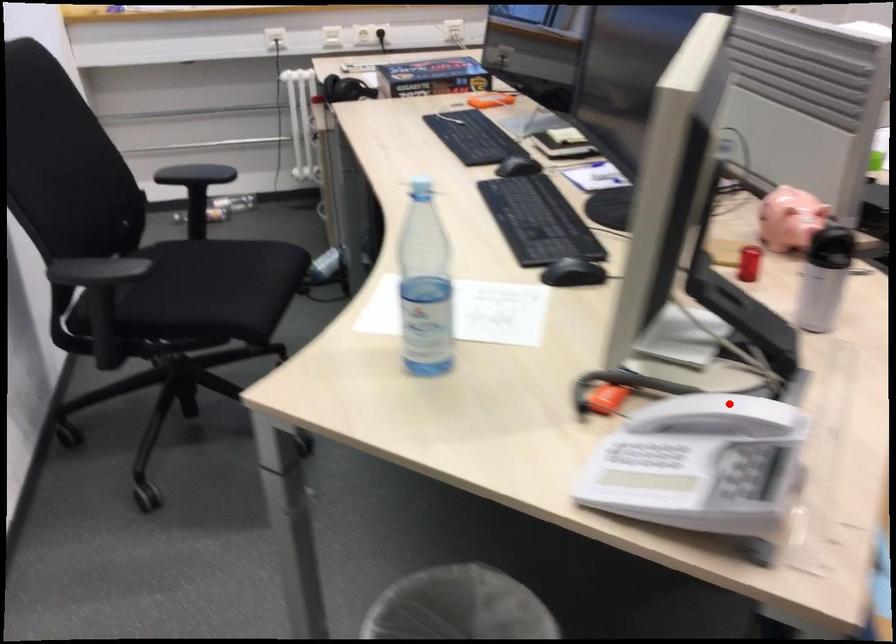
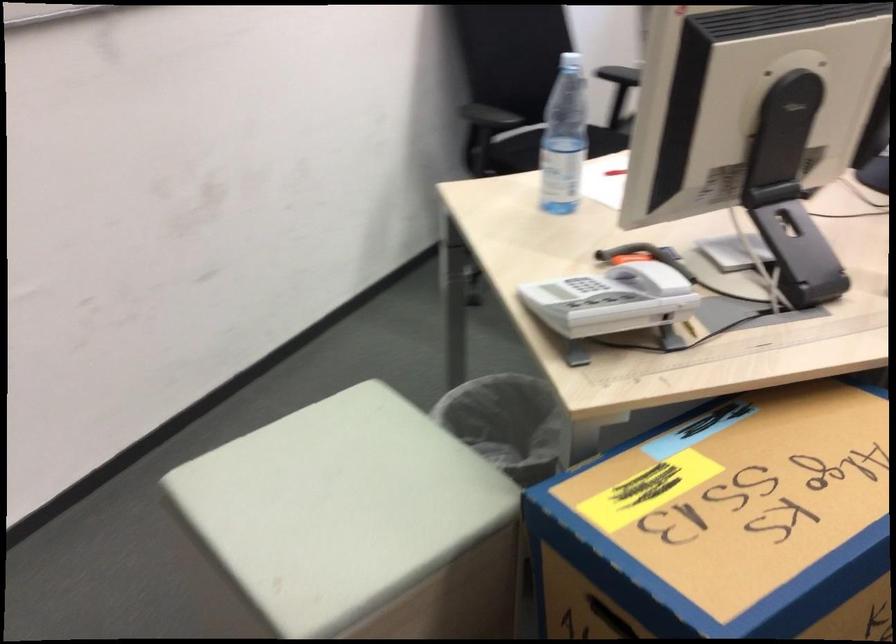
Question: I am providing you with two images of the same scene from different viewpoints. Image1 has a red point marked. In image2, the corresponding 3D location appears at what relative position? Reply with the corresponding letter.

Choices:
 (A) Closer
 (B) Farther

Answer: (B)